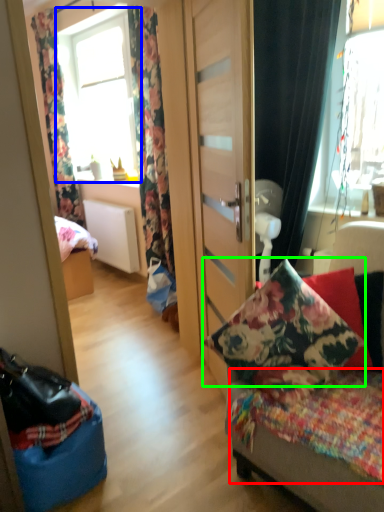
Question: Which object is positioned closest to bedding (highlighted by a red box)? Select from window (highlighted by a blue box) and pillow (highlighted by a green box).

Choices:
 (A) window
 (B) pillow

Answer: (B)